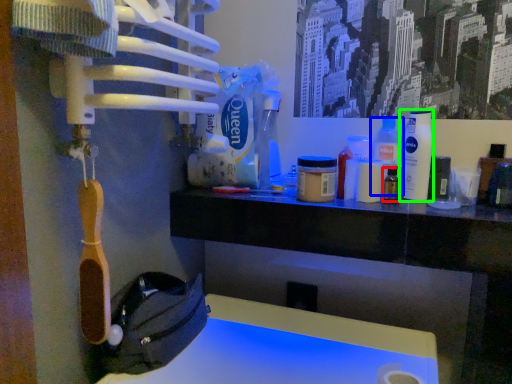
Question: Which object is the closest to the bottle (highlighted by a red box)? Choose among these: cleaning product (highlighted by a blue box) or bottle (highlighted by a green box).

Choices:
 (A) cleaning product
 (B) bottle

Answer: (A)